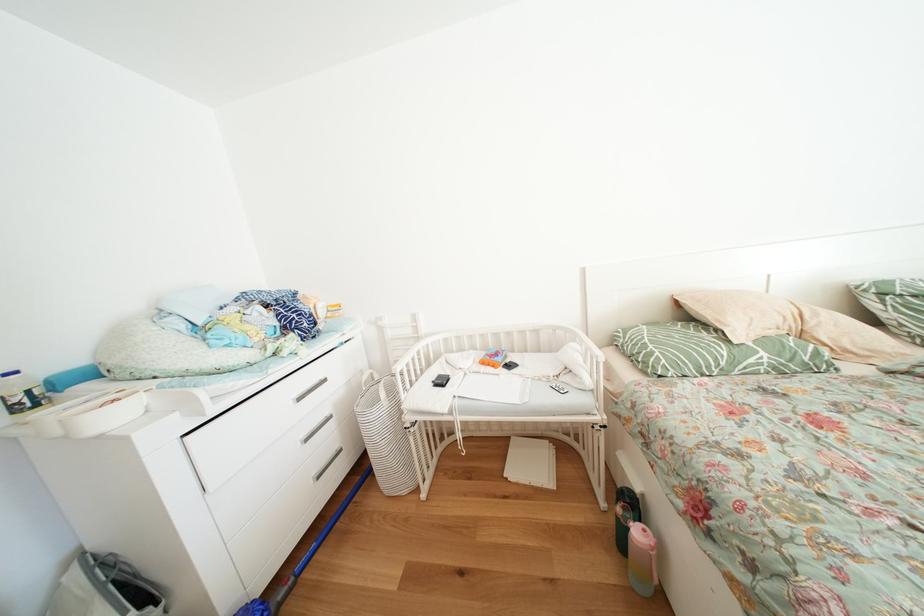
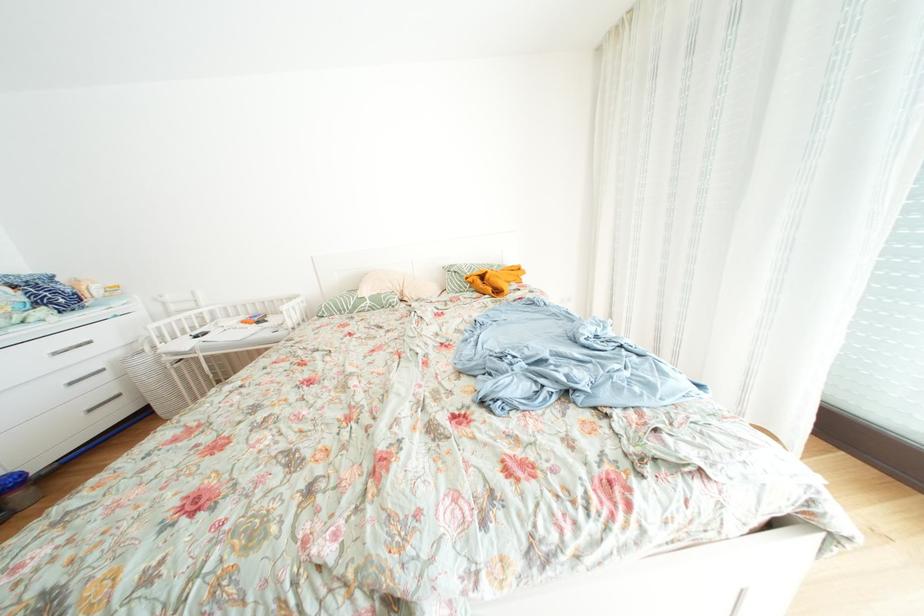
In a continuous first-person perspective shot, in which direction is the camera moving?

The movement direction of the cameraman is right, backward.